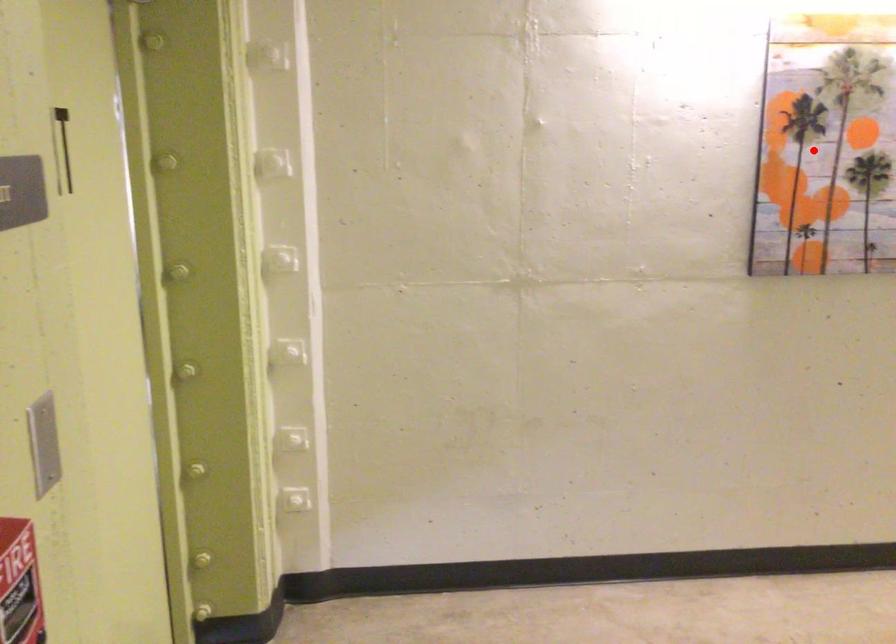
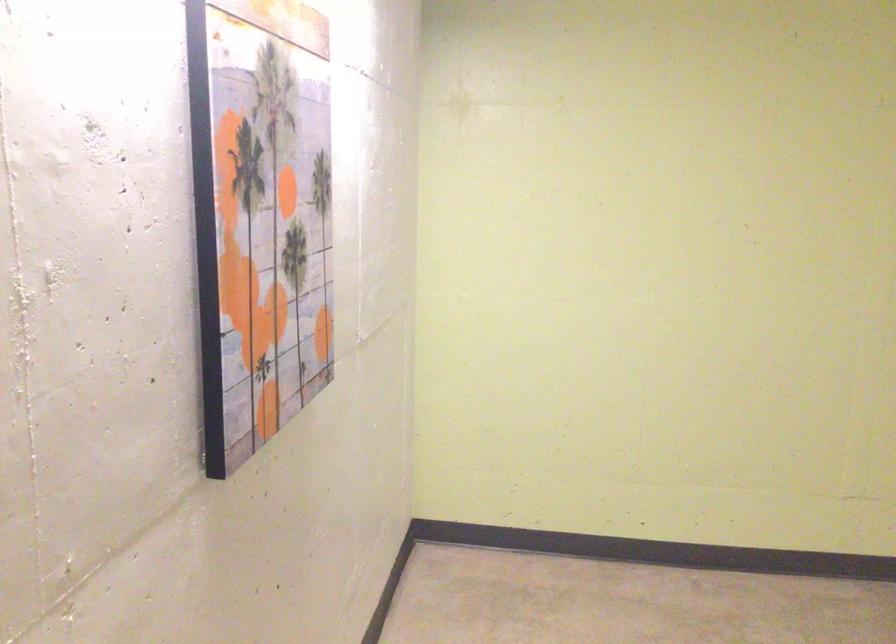
Question: I am providing you with two images of the same scene from different viewpoints. A red point is shown in image1. For the corresponding object point in image2, is it positioned nearer or farther from the camera?

Choices:
 (A) Nearer
 (B) Farther

Answer: (A)